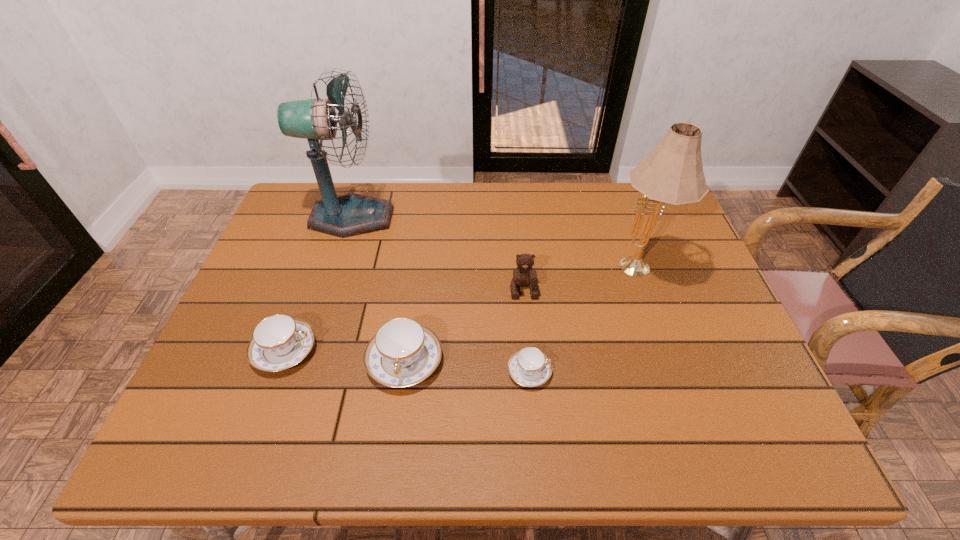
Where is `the leftmost teacup`? The height and width of the screenshot is (540, 960). the leftmost teacup is located at coordinates (279, 342).

Locate an element on the screen. the second tallest teacup is located at coordinates (279, 342).

This screenshot has height=540, width=960. I want to click on the second teacup from right to left, so click(x=402, y=353).

Identify the location of the rightmost teacup. This screenshot has height=540, width=960. (529, 367).

This screenshot has width=960, height=540. Identify the location of the shortest teacup. (529, 367).

Image resolution: width=960 pixels, height=540 pixels. I want to click on the rightmost object, so click(673, 173).

I want to click on fan, so click(x=353, y=214).

Where is `the fourth shortest object`? This screenshot has height=540, width=960. the fourth shortest object is located at coordinates (524, 275).

The height and width of the screenshot is (540, 960). In order to click on vacant space located 0.230m on the side with the handle of the leftmost teacup in this screenshot , I will do `click(415, 350)`.

This screenshot has height=540, width=960. I want to click on vacant space located on the side with the handle of the rightmost teacup, so click(649, 372).